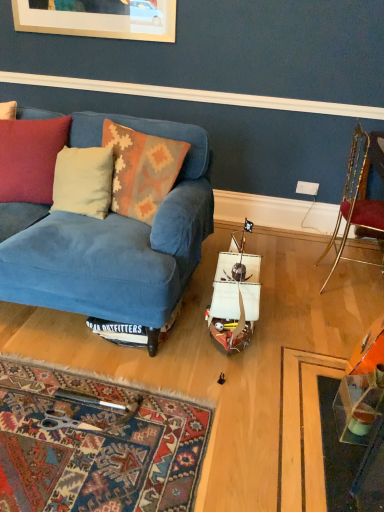
Question: Is gold metallic chair at right positioned in front of transparent plastic table at lower right?

Choices:
 (A) no
 (B) yes

Answer: (A)

Question: Is gold metallic chair at right to the right of transparent plastic table at lower right from the viewer's perspective?

Choices:
 (A) yes
 (B) no

Answer: (A)

Question: Considering the relative sizes of gold metallic chair at right and transparent plastic table at lower right in the image provided, is gold metallic chair at right thinner than transparent plastic table at lower right?

Choices:
 (A) yes
 (B) no

Answer: (B)

Question: Could you tell me if gold metallic chair at right is facing transparent plastic table at lower right?

Choices:
 (A) yes
 (B) no

Answer: (B)

Question: Can you see gold metallic chair at right touching transparent plastic table at lower right?

Choices:
 (A) no
 (B) yes

Answer: (A)

Question: In the image, is beige fabric pillow at left, acting as the 1th pillow starting from the left, on the left side or the right side of knitted wool pillow at center, which is counted as the 2th pillow, starting from the left?

Choices:
 (A) left
 (B) right

Answer: (A)

Question: Is beige fabric pillow at left, which ranks as the 2th pillow in right-to-left order, wider or thinner than knitted wool pillow at center, acting as the 1th pillow starting from the right?

Choices:
 (A) wide
 (B) thin

Answer: (B)

Question: Is point (104, 146) closer or farther from the camera than point (130, 148)?

Choices:
 (A) farther
 (B) closer

Answer: (A)

Question: Considering their positions, is beige fabric pillow at left, acting as the 1th pillow starting from the left, located in front of or behind knitted wool pillow at center, which is counted as the 2th pillow, starting from the left?

Choices:
 (A) front
 (B) behind

Answer: (B)

Question: Is beige fabric pillow at left, acting as the 1th pillow starting from the left, in front of or behind gold metallic chair at right in the image?

Choices:
 (A) behind
 (B) front

Answer: (B)

Question: From a real-world perspective, is beige fabric pillow at left, acting as the 1th pillow starting from the left, physically located above or below gold metallic chair at right?

Choices:
 (A) below
 (B) above

Answer: (B)

Question: Does point (89, 186) appear closer or farther from the camera than point (355, 212)?

Choices:
 (A) closer
 (B) farther

Answer: (A)

Question: From their relative heights in the image, would you say beige fabric pillow at left, which ranks as the 2th pillow in right-to-left order, is taller or shorter than gold metallic chair at right?

Choices:
 (A) tall
 (B) short

Answer: (B)

Question: From a real-world perspective, is velvet cushion at left above or below white plastic power outlet at center?

Choices:
 (A) above
 (B) below

Answer: (A)

Question: From the image's perspective, is velvet cushion at left positioned above or below white plastic power outlet at center?

Choices:
 (A) above
 (B) below

Answer: (B)